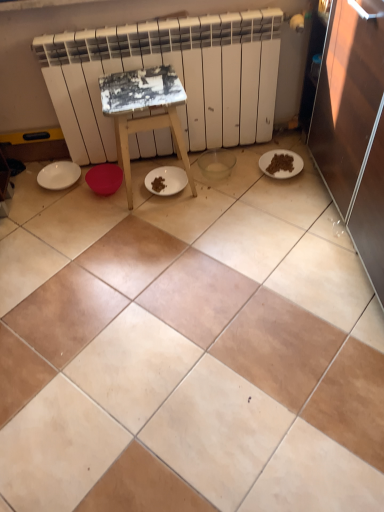
Locate an element on the screen. The width and height of the screenshot is (384, 512). vacant space situated on the left part of white matte plate at lower right, which is the 2th paper plate from left to right is located at coordinates (234, 168).